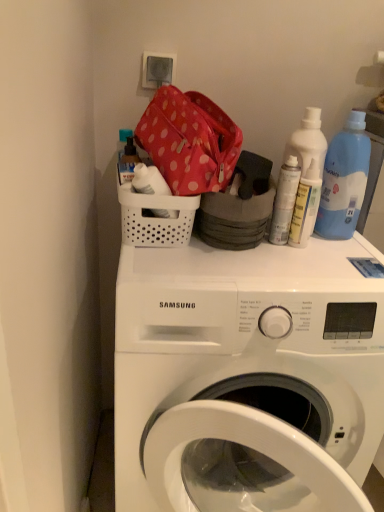
Image resolution: width=384 pixels, height=512 pixels. Find the location of `free space in front of white plastic basket at upper center`. free space in front of white plastic basket at upper center is located at coordinates (183, 275).